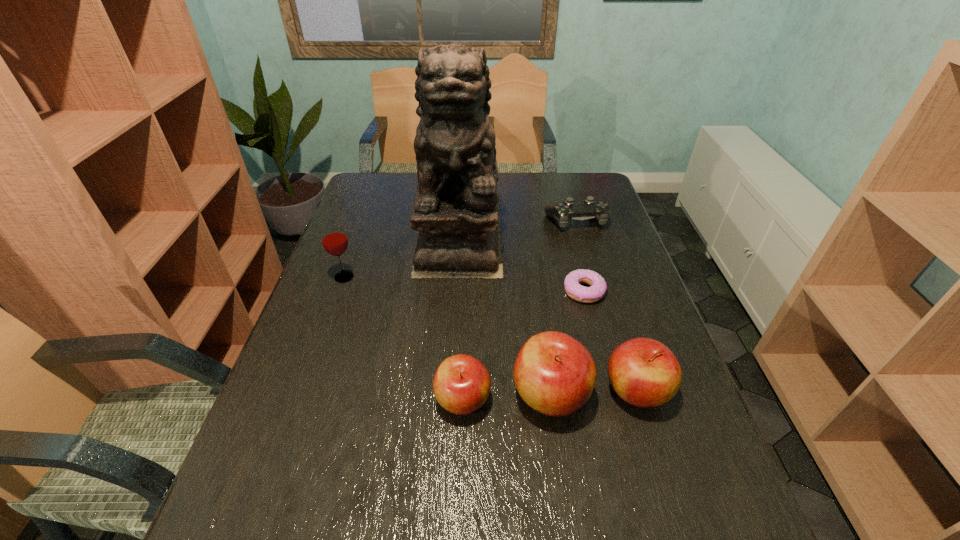
Where is `control present at the right edge`? control present at the right edge is located at coordinates (563, 212).

At what (x,y) coordinates should I click in order to perform the action: click on vacant area at the far edge of the desktop. Please return your answer as a coordinate pair (x, y). Looking at the image, I should click on (537, 194).

The height and width of the screenshot is (540, 960). Identify the location of vacant space at the left edge of the desktop. (300, 423).

The width and height of the screenshot is (960, 540). In the image, there is a desktop. Identify the location of free region at the right edge. (645, 304).

This screenshot has width=960, height=540. Find the location of `free spot at the far left corner of the desktop`. free spot at the far left corner of the desktop is located at coordinates (396, 200).

The height and width of the screenshot is (540, 960). Find the location of `vacant space at the near left corner of the desktop`. vacant space at the near left corner of the desktop is located at coordinates (283, 482).

Locate an element on the screen. The width and height of the screenshot is (960, 540). blank region between the control and the rightmost apple is located at coordinates (606, 306).

The height and width of the screenshot is (540, 960). What are the coordinates of `free space between the sculpture and the glass` in the screenshot? It's located at (402, 256).

This screenshot has width=960, height=540. Find the location of `vacant area that lies between the second apple from left to right and the shortest apple`. vacant area that lies between the second apple from left to right and the shortest apple is located at coordinates (507, 398).

The height and width of the screenshot is (540, 960). I want to click on vacant space that's between the second tallest apple and the second apple from right to left, so click(593, 393).